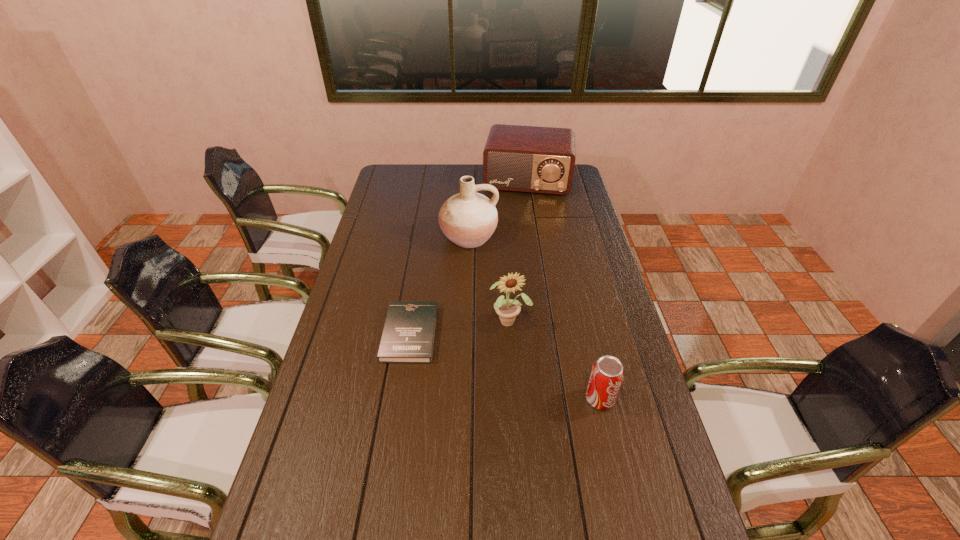
In order to click on the shortest object in this screenshot , I will do `click(408, 336)`.

Locate an element on the screen. soda can is located at coordinates (607, 374).

Where is `the nearest object`? This screenshot has width=960, height=540. the nearest object is located at coordinates (607, 374).

Identify the location of pottery. pyautogui.click(x=468, y=219).

Locate an element on the screen. the farthest object is located at coordinates (534, 159).

The width and height of the screenshot is (960, 540). What are the coordinates of `sunflower` in the screenshot? It's located at (507, 309).

Identify the location of free location located on the right of the shortest object. (502, 334).

Identify the location of free space located on the back of the nearest object. The width and height of the screenshot is (960, 540). (582, 320).

I want to click on blank area located 0.250m to pour from the handle of the second farthest object, so click(x=474, y=301).

This screenshot has width=960, height=540. What are the coordinates of `free point located to pour from the handle of the second farthest object` in the screenshot? It's located at (471, 271).